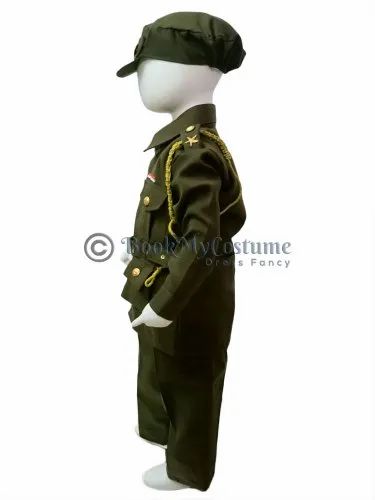
Locate an element on the screen. This screenshot has width=375, height=500. mannequin's left foot is located at coordinates (157, 476).